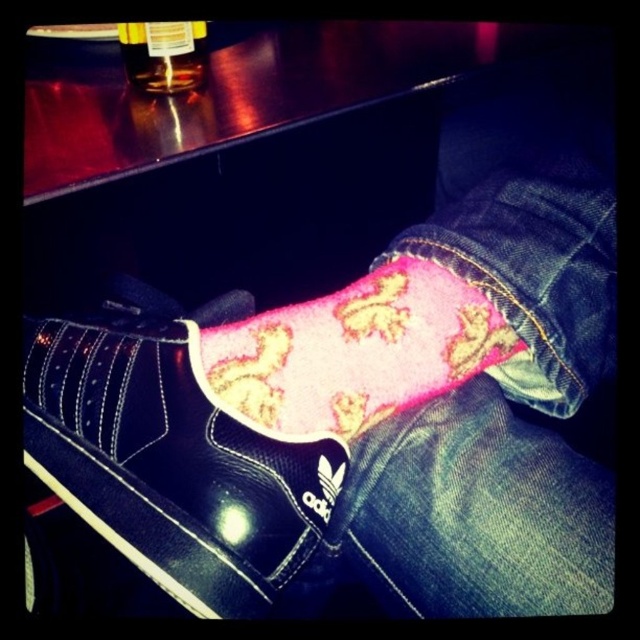
Is black leather shoe at center taller than pink fuzzy socks at center?

Indeed, black leather shoe at center has a greater height compared to pink fuzzy socks at center.

Who is lower down, black leather shoe at center or pink fuzzy socks at center?

black leather shoe at center

Which is in front, point (186, 592) or point (300, 307)?

Point (186, 592) is more forward.

You are a GUI agent. You are given a task and a screenshot of the screen. Output one action in this format:
    pyautogui.click(x=<x>, y=<y>)
    Task: Click on the black leather shoe at center
    The height and width of the screenshot is (640, 640).
    Given the screenshot: What is the action you would take?
    pyautogui.click(x=172, y=458)

Is pink fleece jeans at center behind pink fuzzy socks at center?

No, it is not.

Does pink fleece jeans at center have a greater height compared to pink fuzzy socks at center?

Yes, pink fleece jeans at center is taller than pink fuzzy socks at center.

Locate an element on the screen. The image size is (640, 640). pink fleece jeans at center is located at coordinates (500, 406).

This screenshot has height=640, width=640. What do you see at coordinates (356, 349) in the screenshot? I see `pink fuzzy socks at center` at bounding box center [356, 349].

Does pink fuzzy socks at center have a lesser width compared to translucent plastic bottle at upper left?

No.

Who is more forward, (520, 348) or (195, 44)?

Point (520, 348) is more forward.

At what (x,y) coordinates should I click in order to perform the action: click on pink fuzzy socks at center. Please return your answer as a coordinate pair (x, y). Looking at the image, I should click on (356, 349).